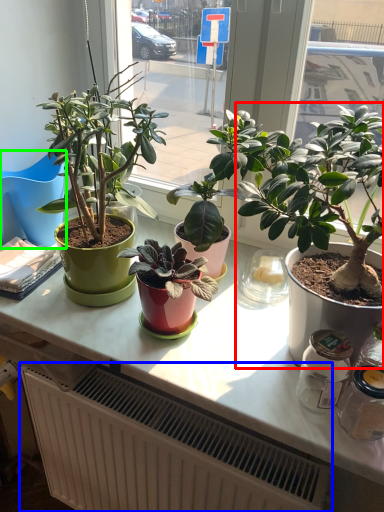
Question: Based on their relative distances, which object is nearer to houseplant (highlighted by a red box)? Choose from radiator (highlighted by a blue box) and chair (highlighted by a green box).

Choices:
 (A) radiator
 (B) chair

Answer: (A)